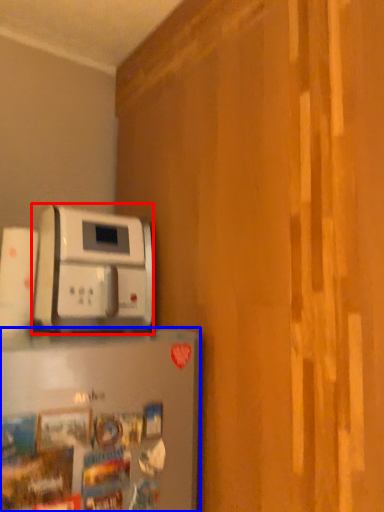
Question: Which point is closer to the camera, home appliance (highlighted by a red box) or home appliance (highlighted by a blue box)?

Choices:
 (A) home appliance
 (B) home appliance

Answer: (B)